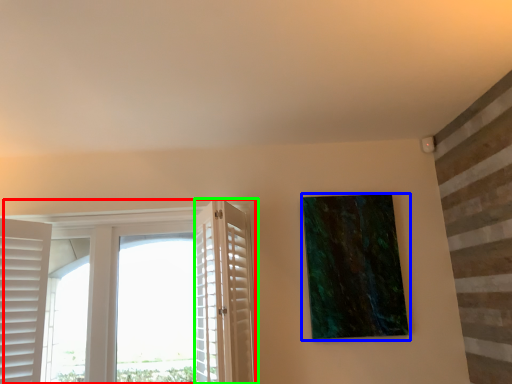
Question: Based on their relative distances, which object is nearer to window (highlighted by a red box)? Choose from picture frame (highlighted by a blue box) and screen door (highlighted by a green box).

Choices:
 (A) picture frame
 (B) screen door

Answer: (B)